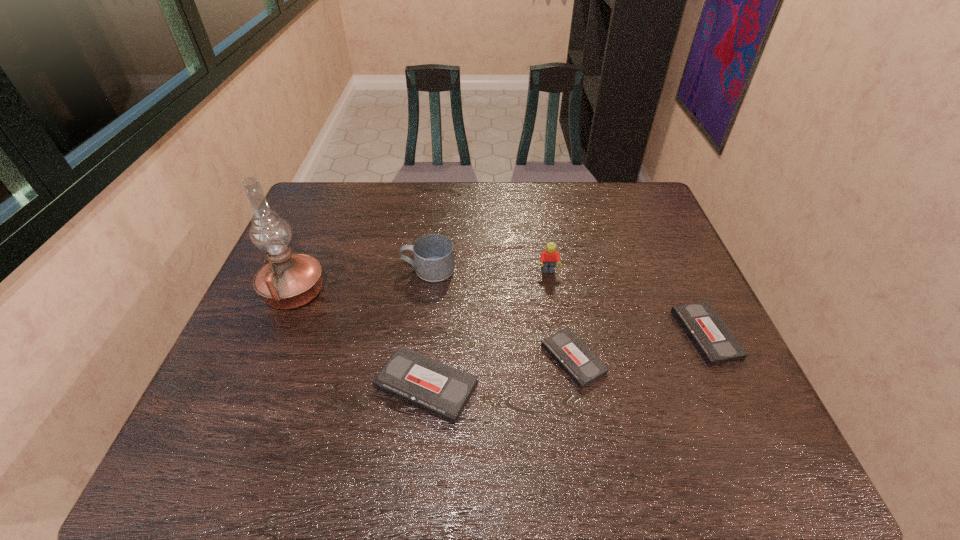
This screenshot has width=960, height=540. Identify the location of free space that is in between the leftmost object and the mug. (362, 281).

Find the location of `vacant area that lies between the mug and the leftmost videotape`. vacant area that lies between the mug and the leftmost videotape is located at coordinates (427, 328).

Locate an element on the screen. blank region between the tallest object and the rightmost videotape is located at coordinates (500, 314).

Locate an element on the screen. This screenshot has height=540, width=960. vacant region between the Lego and the mug is located at coordinates (489, 271).

Where is `free space between the oil lamp and the Lego`? free space between the oil lamp and the Lego is located at coordinates (421, 282).

Where is `the closest object relative to the Lego`? the closest object relative to the Lego is located at coordinates (572, 355).

The width and height of the screenshot is (960, 540). What are the coordinates of `the third closest object to the oil lamp` in the screenshot? It's located at (572, 355).

The image size is (960, 540). I want to click on the closest videotape to the mug, so click(443, 391).

Point out which videotape is positioned as the third nearest to the mug. Please provide its 2D coordinates. Your answer should be formatted as a tuple, i.e. [(x, y)], where the tuple contains the x and y coordinates of a point satisfying the conditions above.

[(713, 340)]

The width and height of the screenshot is (960, 540). Find the location of `vacant area that satisfies the following two spatial constraints: 1. on the face of the rightmost object; 2. on the left side of the Lego`. vacant area that satisfies the following two spatial constraints: 1. on the face of the rightmost object; 2. on the left side of the Lego is located at coordinates pyautogui.click(x=559, y=334).